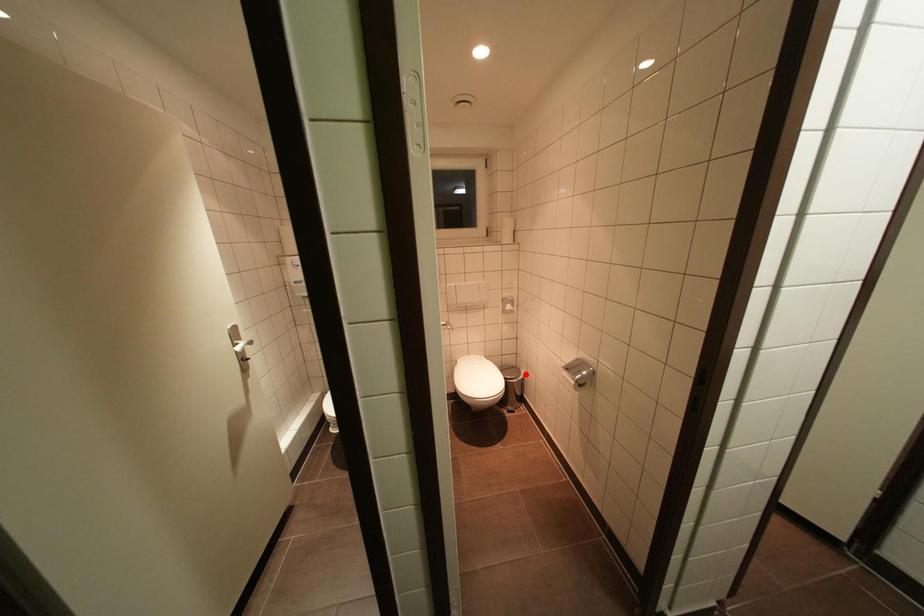
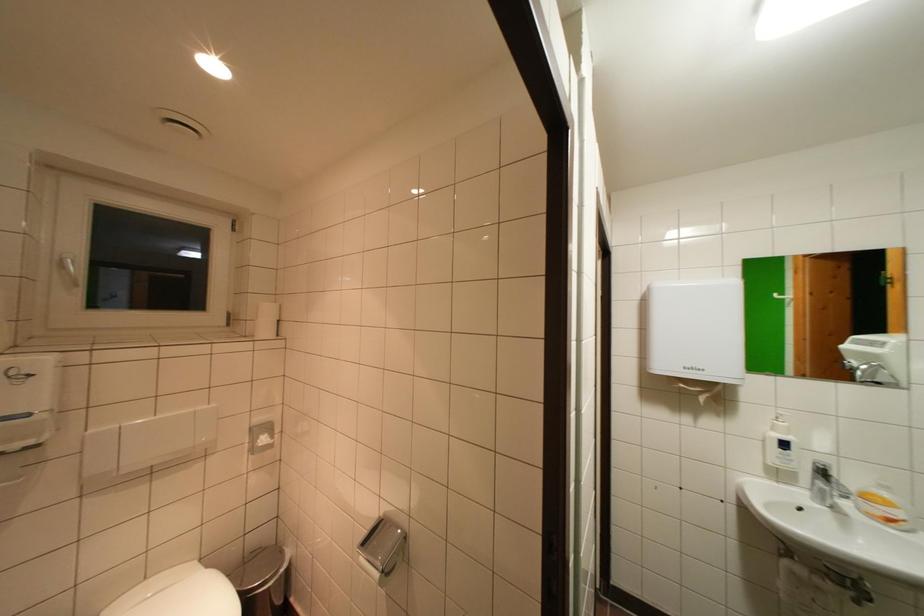
Locate, in the second image, the point that corresponds to the highlighted location in the first image.

(286, 554)